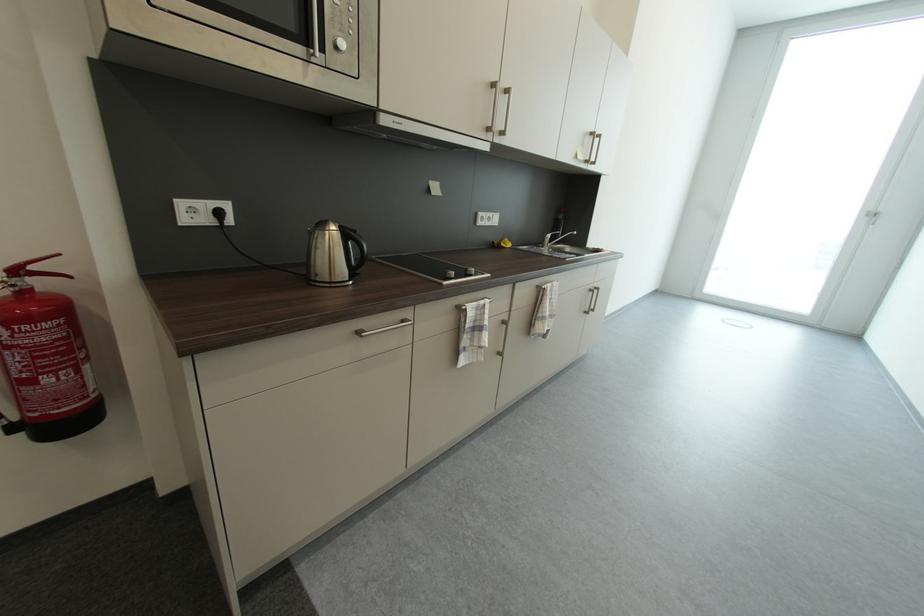
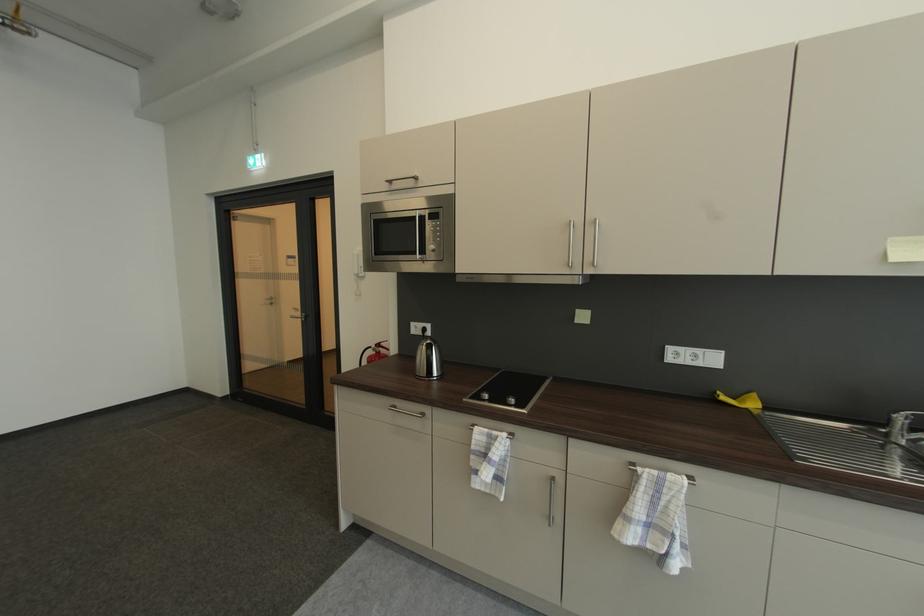
Find the pixel in the second image that matches point (354, 281) in the first image.

(432, 378)